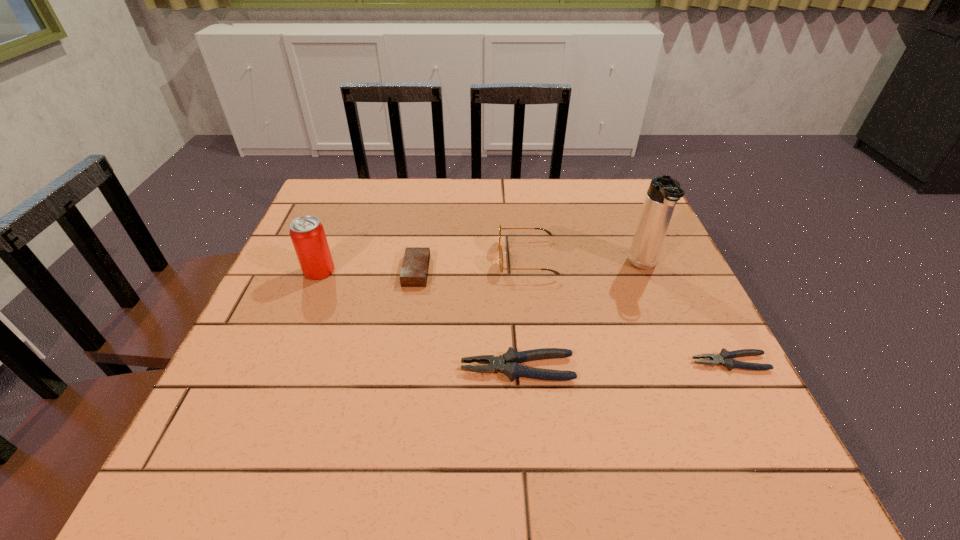
This screenshot has height=540, width=960. Identify the location of vacant point located between the sunglasses and the shortest object. (628, 310).

Find the location of a particular element. the third closest object to the left pliers is located at coordinates (725, 358).

Image resolution: width=960 pixels, height=540 pixels. In order to click on object that stands as the second closest to the leftmost object in this screenshot , I will do `click(508, 363)`.

Image resolution: width=960 pixels, height=540 pixels. Find the location of `vacant space that satisfies the following two spatial constraints: 1. on the lenses of the third tallest object; 2. on the front side of the fifth shortest object`. vacant space that satisfies the following two spatial constraints: 1. on the lenses of the third tallest object; 2. on the front side of the fifth shortest object is located at coordinates (528, 271).

Find the location of a particular element. vacant area in the image that satisfies the following two spatial constraints: 1. on the handle side of the thermos bottle; 2. at the gripping part of the left pliers is located at coordinates (686, 368).